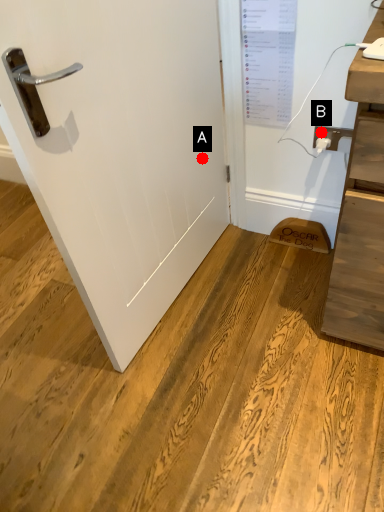
Question: Two points are circled on the image, labeled by A and B beside each circle. Which point appears farthest from the camera in this image?

Choices:
 (A) A is further
 (B) B is further

Answer: (A)